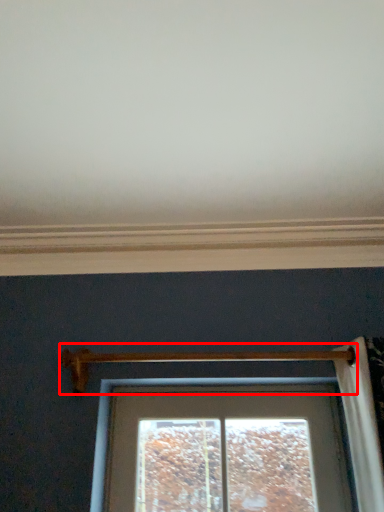
Question: From the image's perspective, where is door handle (annotated by the red box) located in relation to window sill in the image?

Choices:
 (A) above
 (B) below

Answer: (B)